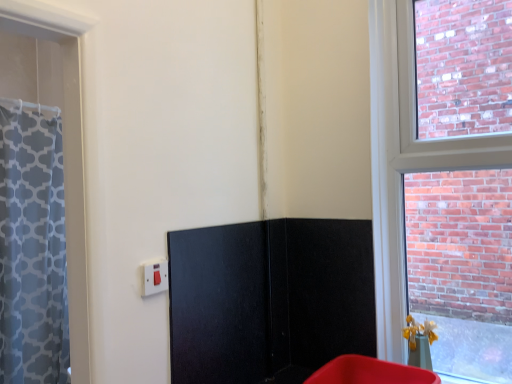
Find the location of a particular element. black matte screen door at center is located at coordinates (219, 304).

This screenshot has height=384, width=512. I want to click on matte white switch at lower left, so click(x=154, y=277).

Is matte plastic bin at lower right not within matte white switch at lower left?

matte plastic bin at lower right is positioned outside matte white switch at lower left.

Does matte plastic bin at lower right appear on the left side of matte white switch at lower left?

No, matte plastic bin at lower right is not to the left of matte white switch at lower left.

Is matte plastic bin at lower right far away from matte white switch at lower left?

Actually, matte plastic bin at lower right and matte white switch at lower left are a little close together.

Is black matte screen door at center inside the boundaries of matte white switch at lower left, or outside?

black matte screen door at center cannot be found inside matte white switch at lower left.

How far apart are black matte screen door at center and matte white switch at lower left?

black matte screen door at center is 27.07 centimeters away from matte white switch at lower left.

Is black matte screen door at center aimed at matte white switch at lower left?

No, black matte screen door at center is not oriented towards matte white switch at lower left.

Between black matte screen door at center and matte white switch at lower left, which one has smaller size?

matte white switch at lower left is smaller.

From the image's perspective, which is below, matte white switch at lower left or matte plastic bin at lower right?

matte plastic bin at lower right, from the image's perspective.

How much distance is there between matte white switch at lower left and matte plastic bin at lower right?

matte white switch at lower left and matte plastic bin at lower right are 67.53 centimeters apart.

Which of these two, matte white switch at lower left or matte plastic bin at lower right, stands shorter?

Standing shorter between the two is matte white switch at lower left.

From a real-world perspective, which object stands above the other?

matte white switch at lower left is physically above.

Considering the sizes of objects matte white switch at lower left and black matte screen door at center in the image provided, who is taller, matte white switch at lower left or black matte screen door at center?

black matte screen door at center.

Relative to black matte screen door at center, is matte white switch at lower left in front or behind?

In the image, matte white switch at lower left appears in front of black matte screen door at center.

Which is closer to the camera, (145, 273) or (233, 353)?

The point (145, 273) is in front.

Consider the image. Considering the relative sizes of matte plastic bin at lower right and black matte screen door at center in the image provided, is matte plastic bin at lower right shorter than black matte screen door at center?

Indeed, matte plastic bin at lower right has a lesser height compared to black matte screen door at center.

Is matte plastic bin at lower right to the left or to the right of black matte screen door at center in the image?

In the image, matte plastic bin at lower right appears on the right side of black matte screen door at center.

What's the angular difference between matte plastic bin at lower right and black matte screen door at center's facing directions?

They differ by 88.5 degrees in their facing directions.

Is matte plastic bin at lower right touching black matte screen door at center?

No, matte plastic bin at lower right is not with black matte screen door at center.

Considering the relative sizes of black matte screen door at center and matte plastic bin at lower right in the image provided, is black matte screen door at center smaller than matte plastic bin at lower right?

Yes, black matte screen door at center is smaller than matte plastic bin at lower right.

Would you say black matte screen door at center is outside matte plastic bin at lower right?

Yes, black matte screen door at center is outside of matte plastic bin at lower right.

What's the angular difference between black matte screen door at center and matte plastic bin at lower right's facing directions?

88.5 degrees.

From the image's perspective, which one is positioned higher, black matte screen door at center or matte plastic bin at lower right?

black matte screen door at center.

I want to click on furniture in front of the matte white switch at lower left, so click(x=370, y=372).

The image size is (512, 384). Identify the location of electric outlet positioned vertically above the black matte screen door at center (from a real-world perspective). (154, 277).

Based on their spatial positions, is matte plastic bin at lower right or matte white switch at lower left closer to black matte screen door at center?

matte white switch at lower left lies closer to black matte screen door at center than the other object.

In the scene shown: From the image, which object appears to be farther from black matte screen door at center, matte white switch at lower left or matte plastic bin at lower right?

matte plastic bin at lower right lies further to black matte screen door at center than the other object.

Estimate the real-world distances between objects in this image. Which object is further from matte white switch at lower left, matte plastic bin at lower right or black matte screen door at center?

matte plastic bin at lower right is further to matte white switch at lower left.

Looking at the image, which one is located closer to matte plastic bin at lower right, black matte screen door at center or matte white switch at lower left?

black matte screen door at center is closer to matte plastic bin at lower right.

Based on the photo, looking at the image, which one is located closer to matte plastic bin at lower right, matte white switch at lower left or black matte screen door at center?

black matte screen door at center is positioned closer to the anchor matte plastic bin at lower right.

From the image, which object appears to be farther from matte white switch at lower left, black matte screen door at center or matte plastic bin at lower right?

Based on the image, matte plastic bin at lower right appears to be further to matte white switch at lower left.

Identify the location of screen door between matte white switch at lower left and matte plastic bin at lower right from left to right. This screenshot has width=512, height=384. (219, 304).